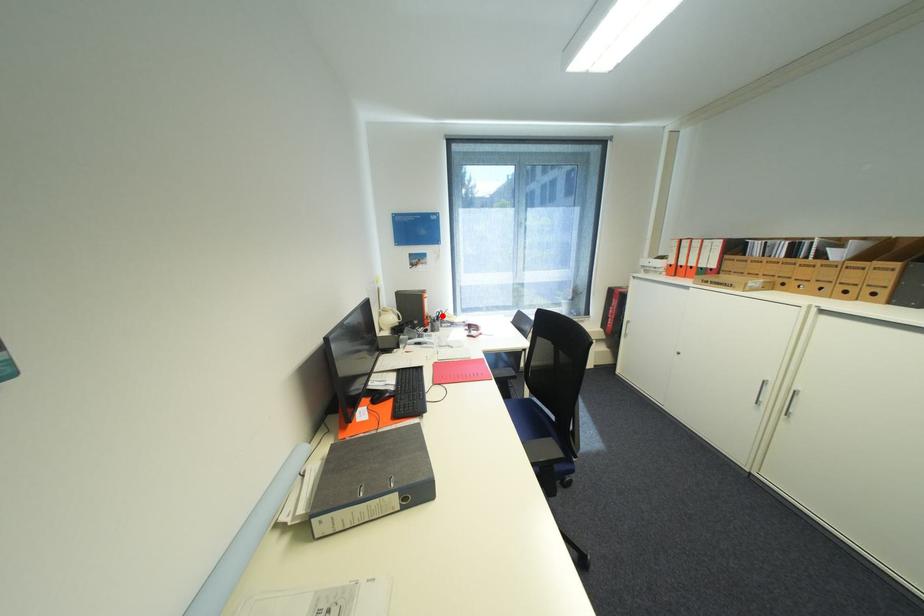
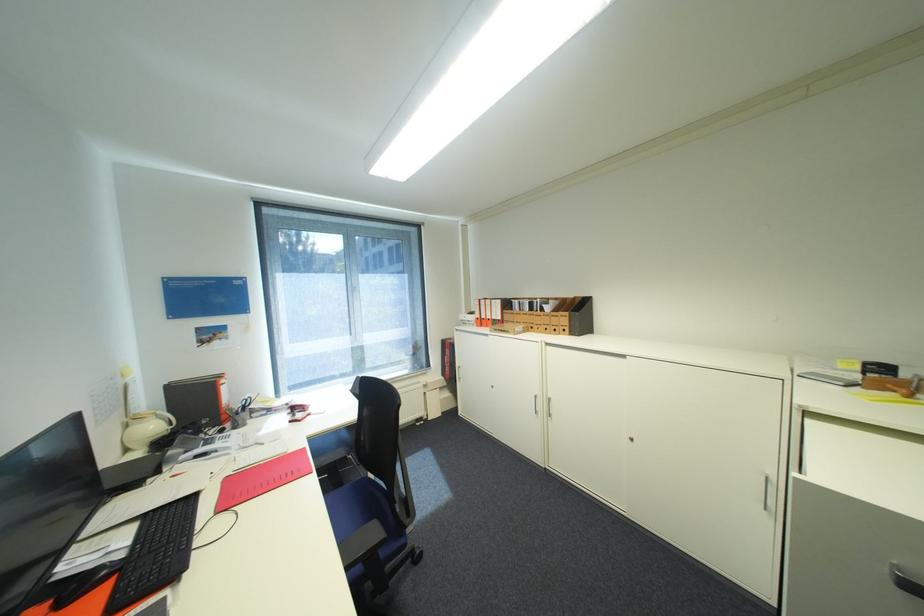
Locate, in the second image, the point that corresponds to the highlighted location in the first image.

(246, 406)